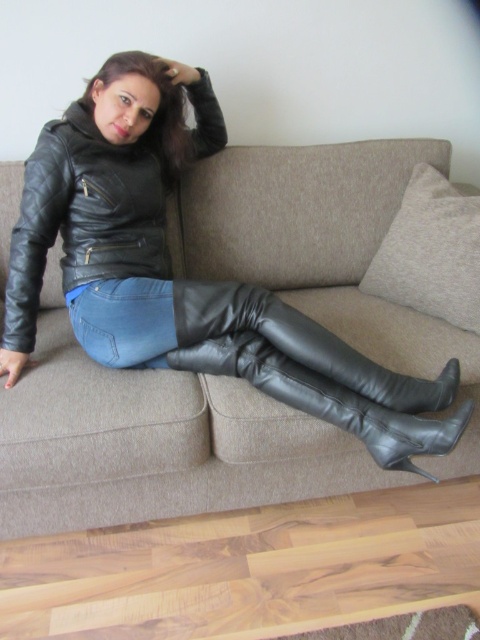
Based on the photo, you are a fashion designer analyzing the outfit of the person sitting on the beige sofa. Which item of clothing is taller in height between the black leather boot at lower center and the blue denim jeans at center?

The black leather boot at lower center is much taller than the blue denim jeans at center.

You are standing in the living room and want to take a photo of the beige fabric couch at center. If your camera has a minimum focus distance of 4 feet, will you need to step back to take the photo?

The beige fabric couch at center is 4.36 feet away from the camera, which is beyond the camera minimum focus distance of 4 feet. Therefore, you do not need to step back to take the photo.